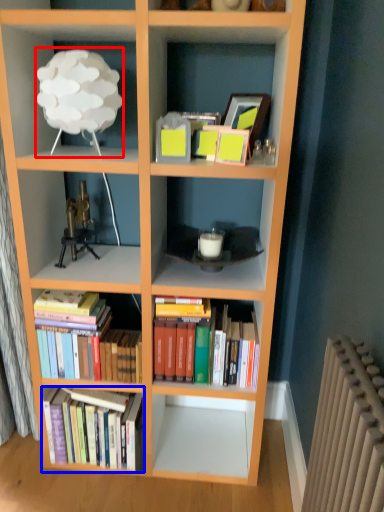
Question: Among these objects, which one is nearest to the camera, lamp (highlighted by a red box) or book (highlighted by a blue box)?

Choices:
 (A) lamp
 (B) book

Answer: (A)